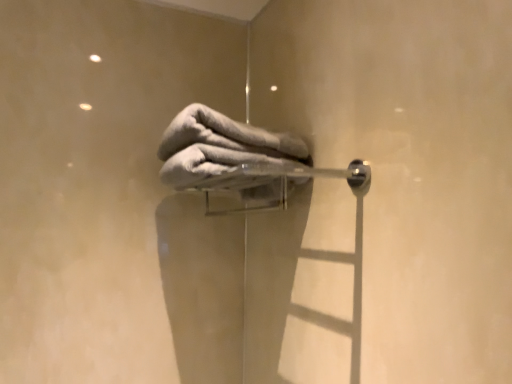
Question: From a real-world perspective, relative to satin silver towel rack at center, is gray soft towel at center vertically above or below?

Choices:
 (A) below
 (B) above

Answer: (B)

Question: Is gray soft towel at center bigger or smaller than satin silver towel rack at center?

Choices:
 (A) big
 (B) small

Answer: (B)

Question: Does point (293, 142) appear closer or farther from the camera than point (264, 210)?

Choices:
 (A) closer
 (B) farther

Answer: (A)

Question: From the image's perspective, is satin silver towel rack at center above or below gray soft towel at center?

Choices:
 (A) above
 (B) below

Answer: (B)

Question: From a real-world perspective, is satin silver towel rack at center physically located above or below gray soft towel at center?

Choices:
 (A) above
 (B) below

Answer: (B)

Question: Is satin silver towel rack at center bigger or smaller than gray soft towel at center?

Choices:
 (A) big
 (B) small

Answer: (A)

Question: Considering their positions, is satin silver towel rack at center located in front of or behind gray soft towel at center?

Choices:
 (A) behind
 (B) front

Answer: (B)